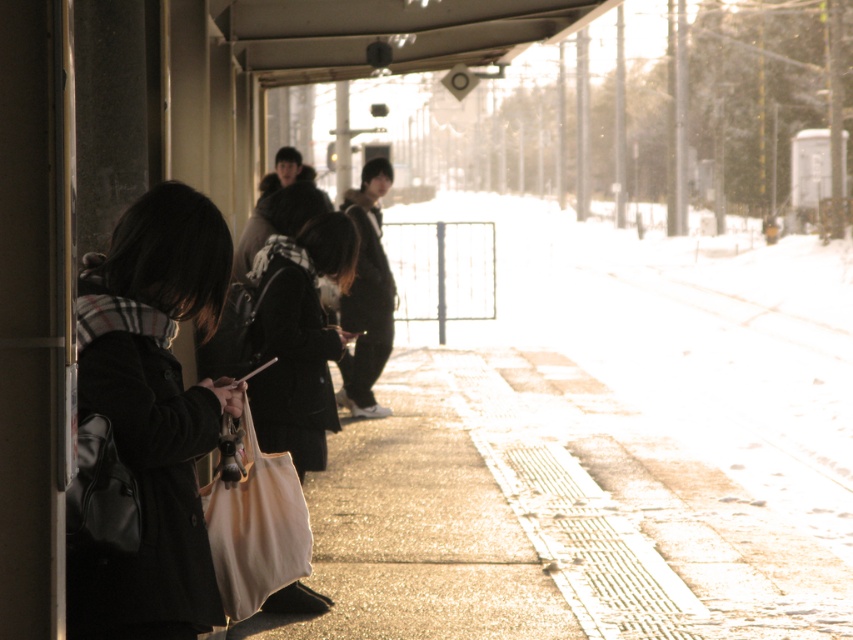
Question: Which point is farther to the camera?

Choices:
 (A) black matte coat at center
 (B) smooth concrete pavement at center
 (C) black wool coat at left

Answer: (B)

Question: Does black matte coat at center have a larger size compared to beige canvas bag at center?

Choices:
 (A) no
 (B) yes

Answer: (B)

Question: Is smooth concrete pavement at center above black wool coat at left?

Choices:
 (A) yes
 (B) no

Answer: (B)

Question: Estimate the real-world distances between objects in this image. Which object is farther from the beige canvas bag at center?

Choices:
 (A) smooth concrete pavement at center
 (B) black wool coat at left
 (C) black matte coat at center

Answer: (A)

Question: Based on their relative distances, which object is nearer to the black wool coat at left?

Choices:
 (A) black matte coat at center
 (B) beige canvas bag at center

Answer: (B)

Question: Considering the relative positions of smooth concrete pavement at center and black wool coat at left in the image provided, where is smooth concrete pavement at center located with respect to black wool coat at left?

Choices:
 (A) left
 (B) right

Answer: (B)